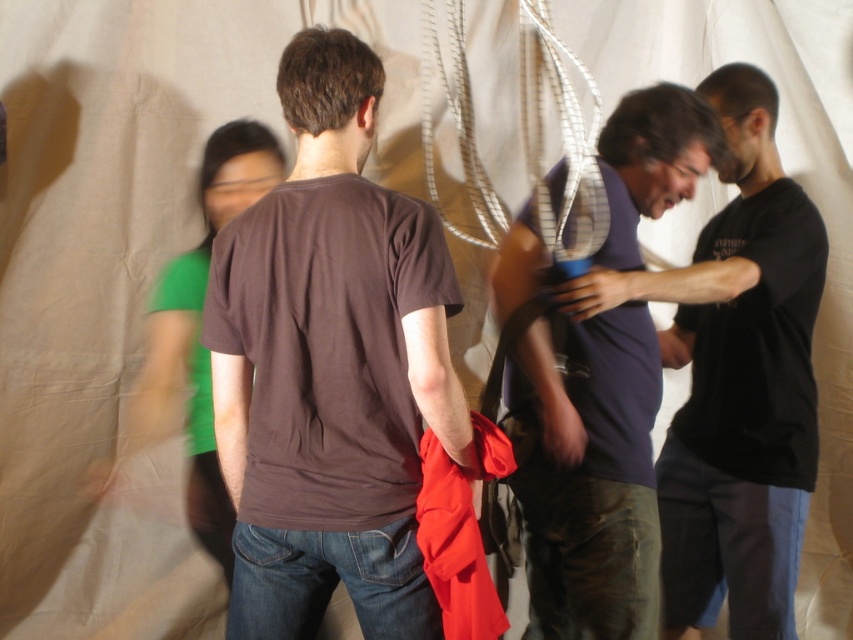
Who is higher up, brown matte t-shirt at center or matte blue shirt at center?

brown matte t-shirt at center is above.

Does brown matte t-shirt at center appear over matte blue shirt at center?

Correct, brown matte t-shirt at center is located above matte blue shirt at center.

Which is in front, point (419, 276) or point (671, 202)?

Point (419, 276) is in front.

Locate an element on the screen. Image resolution: width=853 pixels, height=640 pixels. brown matte t-shirt at center is located at coordinates (331, 368).